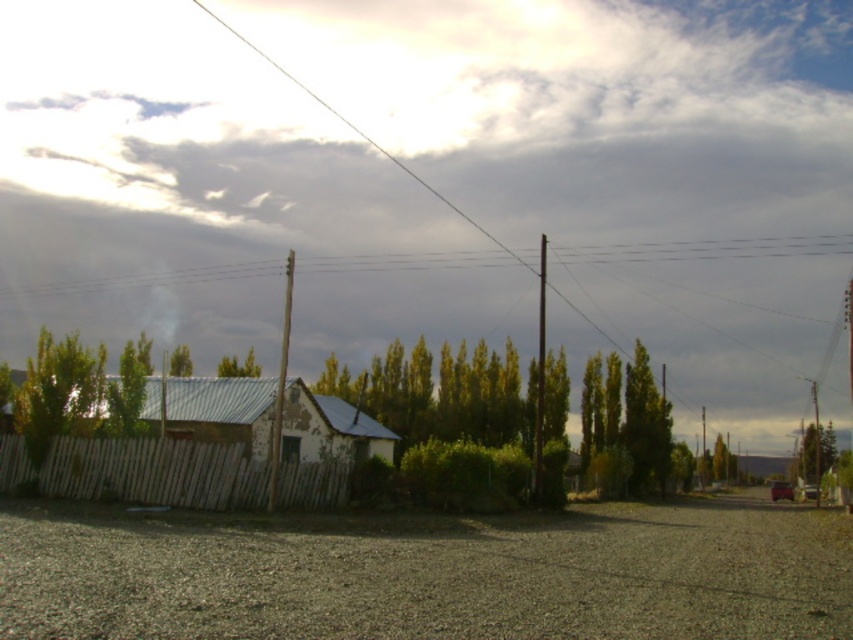
Question: Which object is closer to the camera taking this photo?

Choices:
 (A) smooth wooden pole at center
 (B) white wooden fence at lower left

Answer: (B)

Question: Observing the image, what is the correct spatial positioning of gray gravel at lower center in reference to rusty corrugated metal hut at center?

Choices:
 (A) below
 (B) above

Answer: (A)

Question: Does white wooden fence at lower left appear over rusty corrugated metal hut at center?

Choices:
 (A) yes
 (B) no

Answer: (B)

Question: Does rusty corrugated metal hut at center appear on the right side of smooth wire at upper center?

Choices:
 (A) no
 (B) yes

Answer: (A)

Question: Which object is positioned farthest from the smooth wooden pole at center?

Choices:
 (A) white wooden fence at lower left
 (B) gray gravel at lower center
 (C) rusty corrugated metal hut at center
 (D) smooth wire at upper center

Answer: (D)

Question: Which of the following is the farthest from the observer?

Choices:
 (A) (225, 403)
 (B) (189, 525)
 (C) (244, 481)
 (D) (287, 296)

Answer: (D)